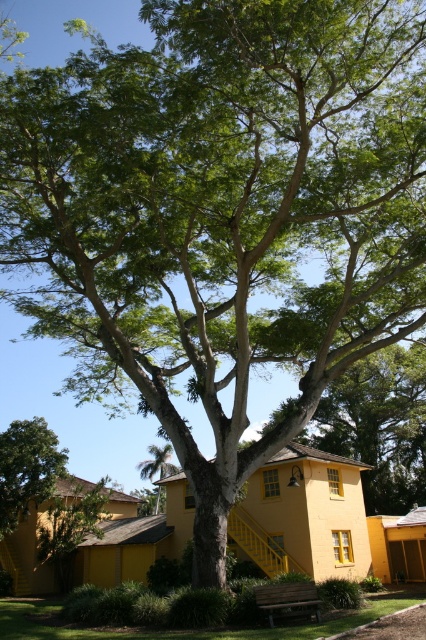
Does green grass at lower center have a lesser height compared to green leafy tree at lower left?

Incorrect, green grass at lower center's height does not fall short of green leafy tree at lower left's.

Who is lower down, green grass at lower center or green leafy tree at lower left?

Positioned lower is green grass at lower center.

Is point (34, 605) positioned after point (5, 438)?

No, it is in front of (5, 438).

Locate an element on the screen. The height and width of the screenshot is (640, 426). green grass at lower center is located at coordinates (189, 628).